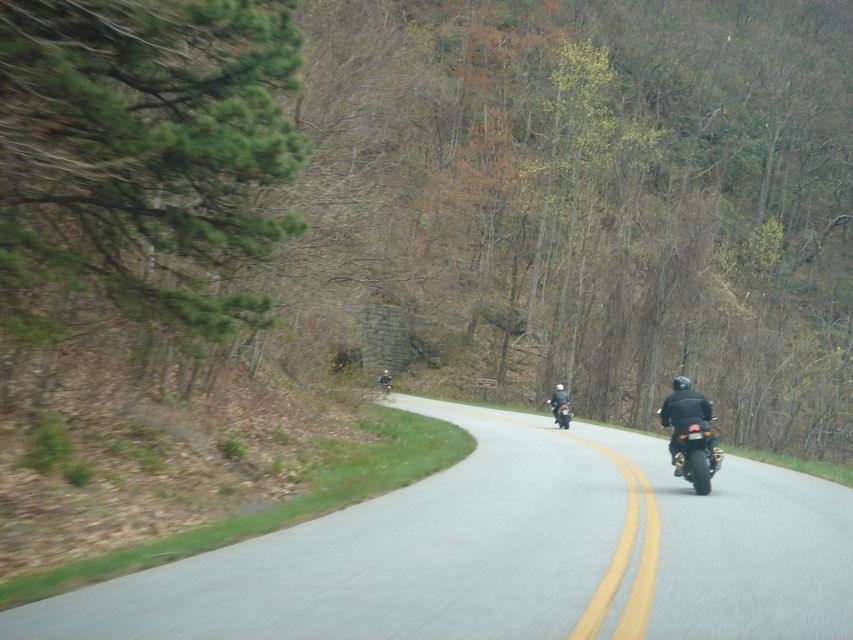
Is gray asphalt road at center behind shiny black motorcycle at right?

No, it is not.

Between gray asphalt road at center and shiny black motorcycle at right, which one appears on the right side from the viewer's perspective?

shiny black motorcycle at right

This screenshot has width=853, height=640. Describe the element at coordinates (509, 554) in the screenshot. I see `gray asphalt road at center` at that location.

Locate an element on the screen. The height and width of the screenshot is (640, 853). gray asphalt road at center is located at coordinates [x=509, y=554].

Find the location of a particular element. The image size is (853, 640). green leafy tree at upper left is located at coordinates 590,198.

Is green leafy tree at upper left to the right of black matte motorcycle at center from the viewer's perspective?

Correct, you'll find green leafy tree at upper left to the right of black matte motorcycle at center.

The image size is (853, 640). In order to click on green leafy tree at upper left in this screenshot , I will do `click(590, 198)`.

Who is more forward, (554,77) or (677,449)?

Point (677,449)

Measure the distance between point [799,177] and camera.

76.34 meters

Is point (759, 8) positioned before point (686, 403)?

No.

Locate an element on the screen. The width and height of the screenshot is (853, 640). green leafy tree at upper left is located at coordinates (590, 198).